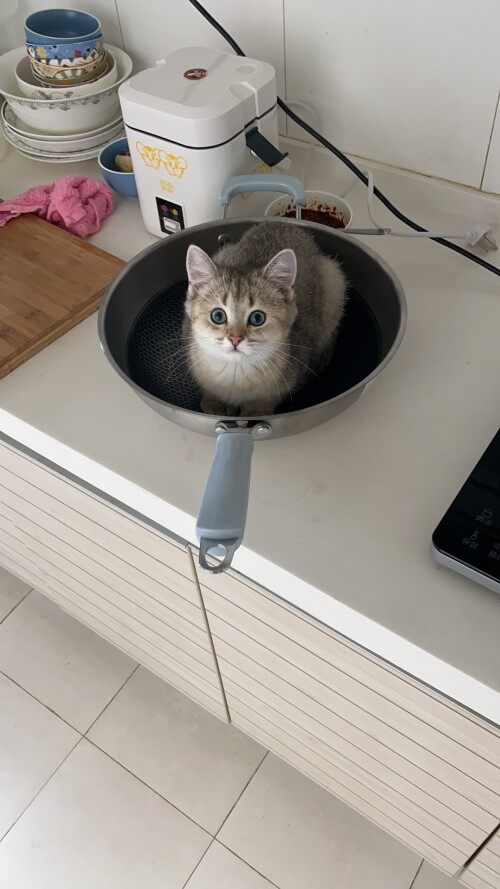
Locate an element on the screen. This screenshot has width=500, height=889. bowls is located at coordinates (52, 63), (39, 92), (48, 113), (50, 148).